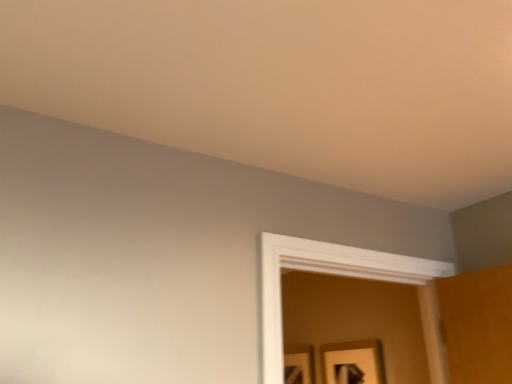
Question: Is matte black picture frame at lower center, which is counted as the 1th picture frame, starting from the back, wider than wooden framed picture at lower right, the second picture frame positioned from the back?

Choices:
 (A) no
 (B) yes

Answer: (A)

Question: Can you confirm if matte black picture frame at lower center, which is counted as the 1th picture frame, starting from the back, is shorter than wooden framed picture at lower right, the second picture frame positioned from the back?

Choices:
 (A) yes
 (B) no

Answer: (B)

Question: Could you tell me if matte black picture frame at lower center, the second picture frame positioned from the right, is turned towards wooden framed picture at lower right, which is the 2th picture frame in left-to-right order?

Choices:
 (A) no
 (B) yes

Answer: (A)

Question: Is matte black picture frame at lower center, the 2th picture frame when ordered from front to back, outside of wooden framed picture at lower right, the 1th picture frame viewed from the front?

Choices:
 (A) no
 (B) yes

Answer: (B)

Question: Is matte black picture frame at lower center, which is counted as the 1th picture frame, starting from the back, thinner than wooden framed picture at lower right, the 1th picture frame viewed from the front?

Choices:
 (A) yes
 (B) no

Answer: (A)

Question: From the image's perspective, is matte black picture frame at lower center, the 2th picture frame when ordered from front to back, on wooden framed picture at lower right, which is the 2th picture frame in left-to-right order?

Choices:
 (A) yes
 (B) no

Answer: (B)

Question: From the image's perspective, is wooden framed picture at lower right, the 1th picture frame viewed from the front, located beneath matte black picture frame at lower center, the 2th picture frame when ordered from front to back?

Choices:
 (A) yes
 (B) no

Answer: (B)

Question: From the image's perspective, is wooden framed picture at lower right, the second picture frame positioned from the back, on matte black picture frame at lower center, the 1th picture frame in the left-to-right sequence?

Choices:
 (A) yes
 (B) no

Answer: (A)

Question: Is wooden framed picture at lower right, the second picture frame positioned from the back, to the left of matte black picture frame at lower center, the 2th picture frame when ordered from front to back, from the viewer's perspective?

Choices:
 (A) no
 (B) yes

Answer: (A)

Question: From a real-world perspective, is wooden framed picture at lower right, the 1th picture frame viewed from the front, located beneath matte black picture frame at lower center, which is counted as the 1th picture frame, starting from the back?

Choices:
 (A) yes
 (B) no

Answer: (B)

Question: Considering the relative sizes of wooden framed picture at lower right, the second picture frame positioned from the back, and matte black picture frame at lower center, the second picture frame positioned from the right, in the image provided, is wooden framed picture at lower right, the second picture frame positioned from the back, taller than matte black picture frame at lower center, the second picture frame positioned from the right,?

Choices:
 (A) yes
 (B) no

Answer: (B)

Question: Is wooden framed picture at lower right, which is the 2th picture frame in left-to-right order, bigger than matte black picture frame at lower center, the 2th picture frame when ordered from front to back?

Choices:
 (A) yes
 (B) no

Answer: (A)

Question: Is matte black picture frame at lower center, the 1th picture frame in the left-to-right sequence, situated inside wooden framed picture at lower right, the 1th picture frame in the right-to-left sequence, or outside?

Choices:
 (A) outside
 (B) inside

Answer: (A)